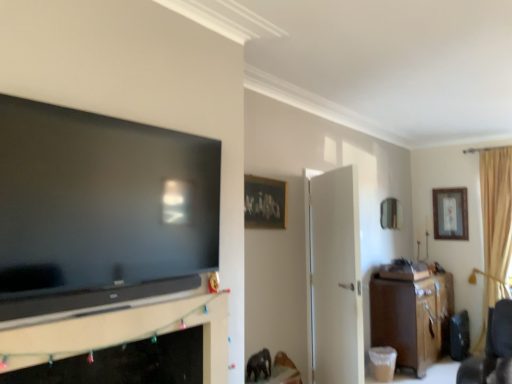
Question: From a real-world perspective, is metallic mirror at upper right, the 2th picture frame in the right-to-left sequence, physically located above or below brown wood cabinet at right?

Choices:
 (A) above
 (B) below

Answer: (A)

Question: Is metallic mirror at upper right, the second picture frame when ordered from front to back, to the left or to the right of brown wood cabinet at right in the image?

Choices:
 (A) left
 (B) right

Answer: (A)

Question: Based on their relative distances, which object is farther from the brown wood cabinet at right?

Choices:
 (A) beige fabric curtain at right
 (B) metallic mirror at upper right, the second picture frame when ordered from front to back
 (C) black matte fireplace at lower left
 (D) white matte door at center
 (E) wooden framed artwork at upper center, placed as the first picture frame when sorted from left to right

Answer: (C)

Question: Which object is the closest to the brown wood cabinet at right?

Choices:
 (A) beige fabric curtain at right
 (B) metallic mirror at upper right, the 2th picture frame in the right-to-left sequence
 (C) wooden framed artwork at upper center, marked as the first picture frame in a front-to-back arrangement
 (D) black matte fireplace at lower left
 (E) white matte door at center

Answer: (B)